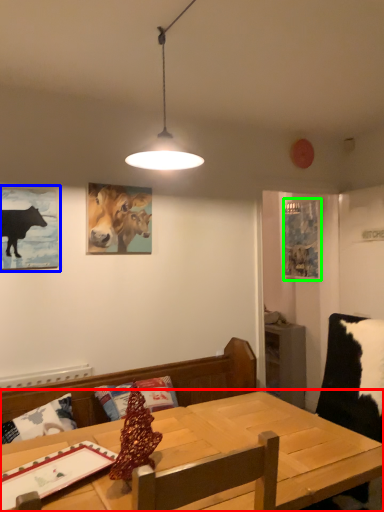
Question: Estimate the real-world distances between objects in this image. Which object is farther from table (highlighted by a red box), picture frame (highlighted by a blue box) or picture frame (highlighted by a green box)?

Choices:
 (A) picture frame
 (B) picture frame

Answer: (B)